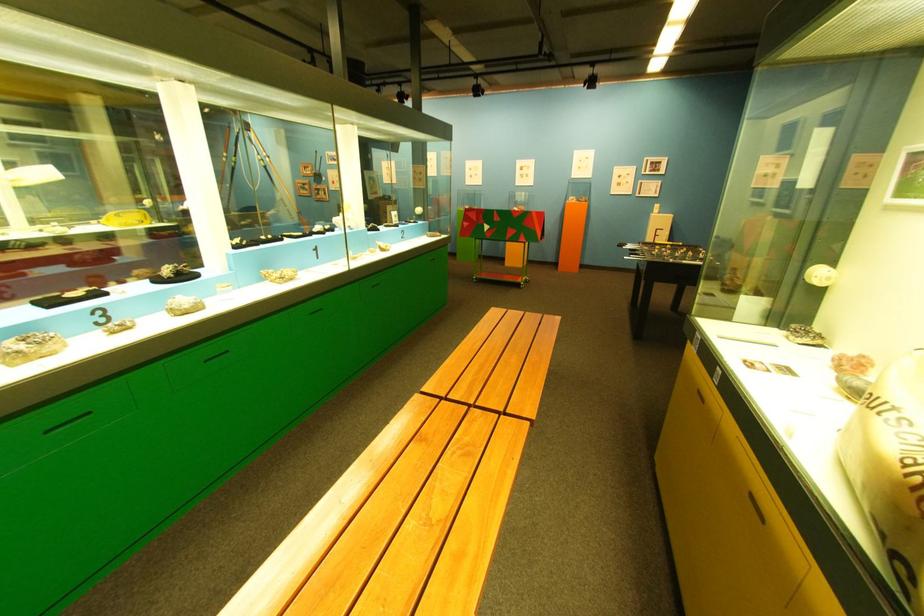
Where is `yellow cabinet handle`? This screenshot has width=924, height=616. yellow cabinet handle is located at coordinates (700, 395).